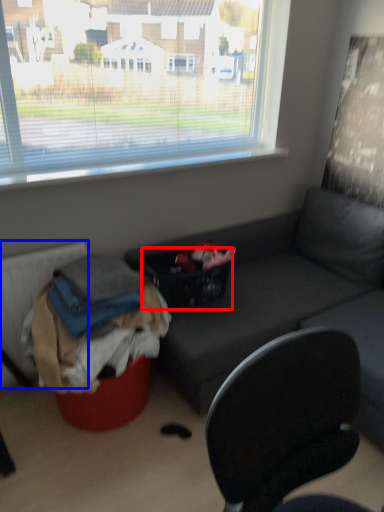
Question: Which object is closer to the camera taking this photo, basket (highlighted by a red box) or radiator (highlighted by a blue box)?

Choices:
 (A) basket
 (B) radiator

Answer: (B)